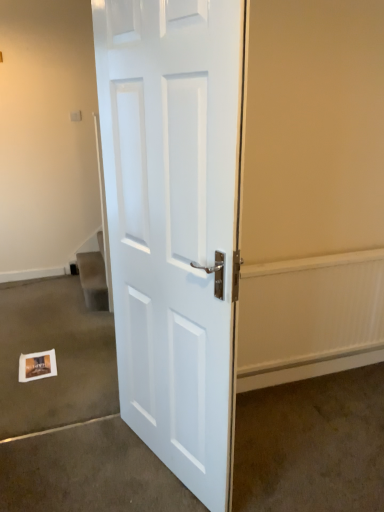
Question: In the image, is white glossy door at center positioned in front of or behind white paper at lower left, the 2th concrete viewed from the right?

Choices:
 (A) front
 (B) behind

Answer: (A)

Question: In terms of width, does white glossy door at center look wider or thinner when compared to white paper at lower left, the 2th concrete viewed from the right?

Choices:
 (A) wide
 (B) thin

Answer: (B)

Question: Which of these objects is positioned farthest from the white glossy door at center?

Choices:
 (A) matte white door at center, the 1th concrete viewed from the right
 (B) white matte postcard at lower left
 (C) white paper at lower left, the 1th concrete positioned from the left

Answer: (B)

Question: Estimate the real-world distances between objects in this image. Which object is closer to the white matte postcard at lower left?

Choices:
 (A) matte white door at center, the 1th concrete viewed from the right
 (B) white paper at lower left, the 2th concrete viewed from the right
 (C) white glossy door at center

Answer: (B)